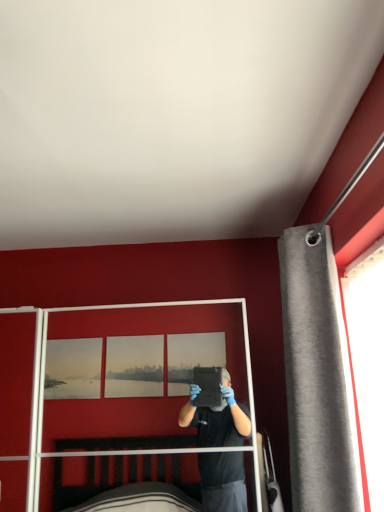
Question: Is gray fabric curtain at right shorter than clear plastic screen door at center?

Choices:
 (A) yes
 (B) no

Answer: (B)

Question: Is gray fabric curtain at right wider than clear plastic screen door at center?

Choices:
 (A) no
 (B) yes

Answer: (A)

Question: Is gray fabric curtain at right next to clear plastic screen door at center?

Choices:
 (A) no
 (B) yes

Answer: (A)

Question: Is gray fabric curtain at right outside of clear plastic screen door at center?

Choices:
 (A) no
 (B) yes

Answer: (B)

Question: Does gray fabric curtain at right have a greater height compared to clear plastic screen door at center?

Choices:
 (A) no
 (B) yes

Answer: (B)

Question: Is gray fabric curtain at right bigger than clear plastic screen door at center?

Choices:
 (A) yes
 (B) no

Answer: (B)

Question: Can you confirm if clear plastic screen door at center is positioned to the right of gray fabric curtain at right?

Choices:
 (A) yes
 (B) no

Answer: (B)

Question: Does clear plastic screen door at center come in front of gray fabric curtain at right?

Choices:
 (A) yes
 (B) no

Answer: (B)

Question: Considering the relative positions of clear plastic screen door at center and gray fabric curtain at right in the image provided, is clear plastic screen door at center behind gray fabric curtain at right?

Choices:
 (A) no
 (B) yes

Answer: (B)

Question: From a real-world perspective, is clear plastic screen door at center physically below gray fabric curtain at right?

Choices:
 (A) yes
 (B) no

Answer: (A)

Question: Considering the relative sizes of clear plastic screen door at center and gray fabric curtain at right in the image provided, is clear plastic screen door at center wider than gray fabric curtain at right?

Choices:
 (A) yes
 (B) no

Answer: (A)

Question: Is clear plastic screen door at center shorter than gray fabric curtain at right?

Choices:
 (A) no
 (B) yes

Answer: (B)

Question: Is gray fabric curtain at right inside the boundaries of clear plastic screen door at center, or outside?

Choices:
 (A) outside
 (B) inside

Answer: (A)